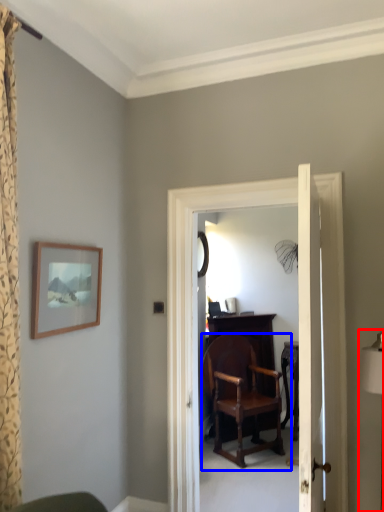
Question: Which object is closer to the camera taking this photo, table lamp (highlighted by a red box) or chair (highlighted by a blue box)?

Choices:
 (A) table lamp
 (B) chair

Answer: (A)